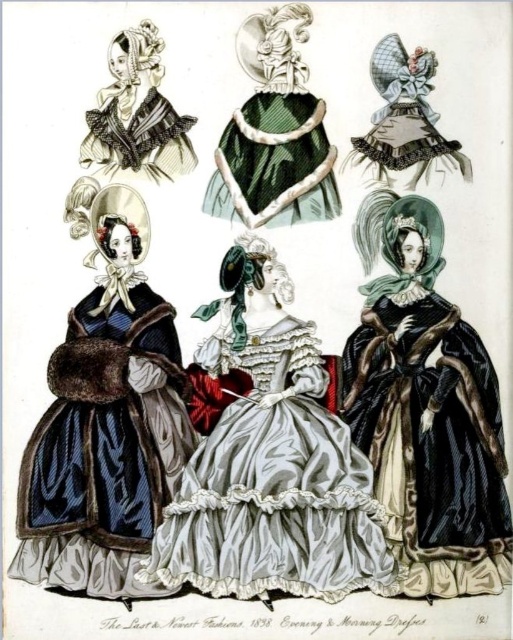
Question: Which point is farther from the camera taking this photo?

Choices:
 (A) click(284, 344)
 (B) click(416, 536)

Answer: (A)

Question: Does green satin capelet at center come in front of matte black bonnet at upper left?

Choices:
 (A) yes
 (B) no

Answer: (A)

Question: Can you confirm if green satin capelet at center is smaller than matte black bonnet at upper left?

Choices:
 (A) yes
 (B) no

Answer: (B)

Question: Which point is farther to the camera?

Choices:
 (A) velvet black cape at right
 (B) green satin capelet at center
 (C) matte black bonnet at upper left
 (D) silvery satin gown at center

Answer: (C)

Question: Does silvery satin gown at center appear on the left side of matte black bonnet at upper left?

Choices:
 (A) no
 (B) yes

Answer: (A)

Question: Which object appears farthest from the camera in this image?

Choices:
 (A) green satin capelet at center
 (B) silvery satin gown at center
 (C) matte black bonnet at upper left
 (D) velvet black cape at right

Answer: (C)